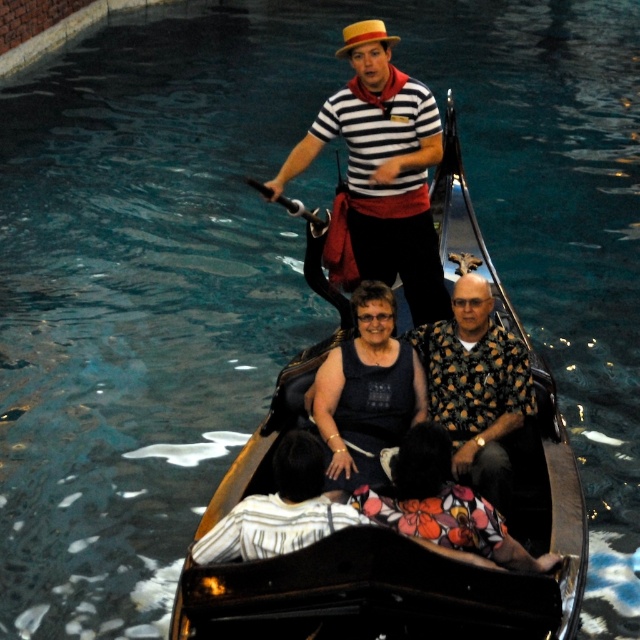
How much distance is there between floral print shirt at center and floral fabric dress at center?

They are 3.74 meters apart.

Who is positioned more to the left, floral print shirt at center or floral fabric dress at center?

floral fabric dress at center is more to the left.

Is point (518, 417) less distant than point (416, 534)?

No, (518, 417) is further to viewer.

You are a GUI agent. You are given a task and a screenshot of the screen. Output one action in this format:
    pyautogui.click(x=<x>, y=<y>)
    Task: Click on the floral print shirt at center
    The image size is (640, 640).
    Given the screenshot: What is the action you would take?
    pyautogui.click(x=476, y=387)

Is point (481, 545) farther from camera compared to point (214, 538)?

That is True.

Does point (413, 477) come in front of point (316, 490)?

No, (413, 477) is further to viewer.

Where is `floral fabric dress at center`? This screenshot has height=640, width=640. floral fabric dress at center is located at coordinates (444, 506).

Who is more forward, (484, 428) or (352, 394)?

Point (484, 428)

Describe the element at coordinates (476, 387) in the screenshot. I see `floral print shirt at center` at that location.

Is point (531, 394) positioned behind point (330, 362)?

No.

What are the coordinates of `floral print shirt at center` in the screenshot? It's located at [476, 387].